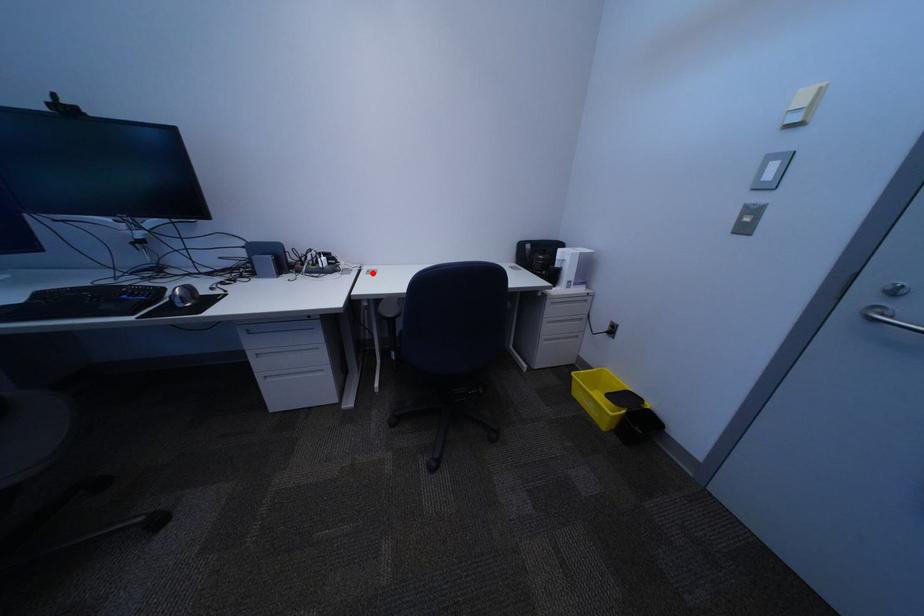
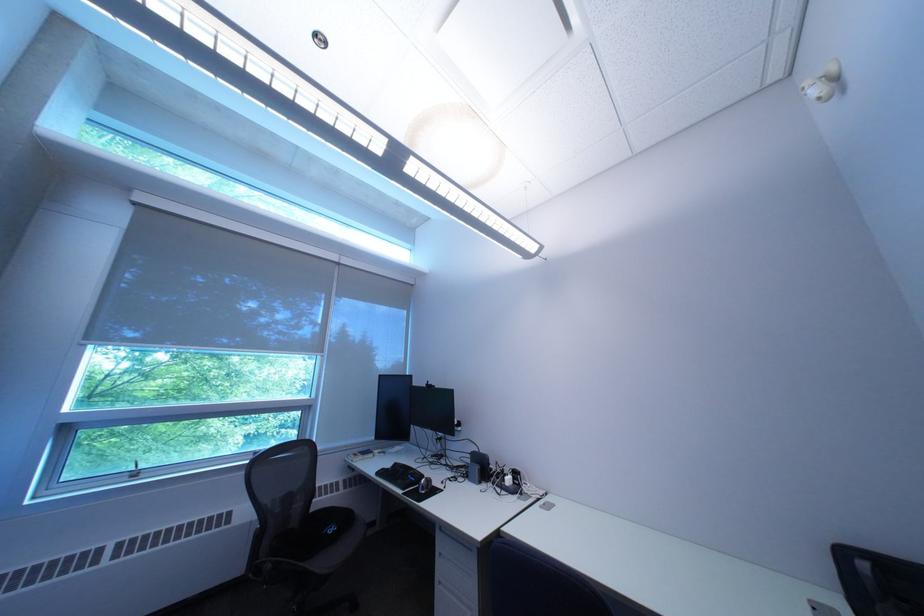
Question: I am providing you with two images of the same scene from different viewpoints. In image1, a red point is highlighted. Considering the same 3D point in image2, which of the following is correct?

Choices:
 (A) It is closer
 (B) It is farther

Answer: (A)